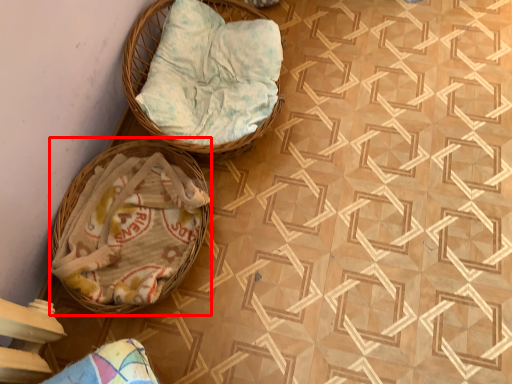
Question: From the image's perspective, what is the correct spatial relationship of basket (annotated by the red box) in relation to basket?

Choices:
 (A) above
 (B) below

Answer: (B)